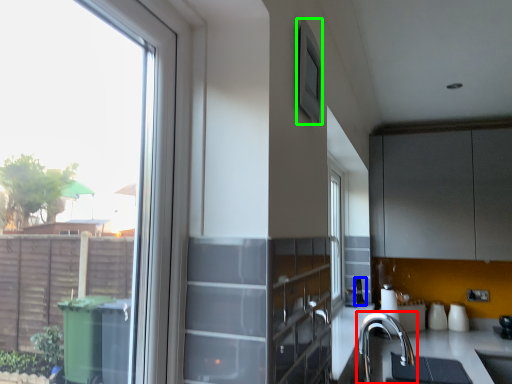
Question: Which is nearer to the tap (highlighted by a red box)? appliance (highlighted by a blue box) or window screen (highlighted by a green box).

Choices:
 (A) appliance
 (B) window screen

Answer: (A)